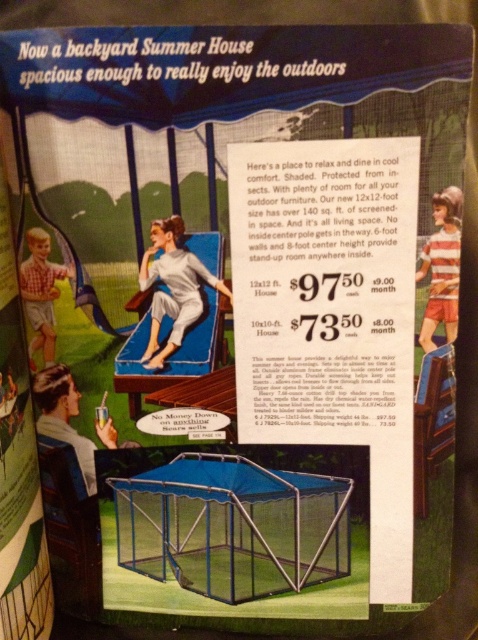
Is blue mesh cage at center below matte white lounge chair at center?

Yes, blue mesh cage at center is below matte white lounge chair at center.

Does point (173, 548) come in front of point (152, 272)?

No, it is behind (152, 272).

Describe the element at coordinates (232, 525) in the screenshot. This screenshot has height=640, width=478. I see `blue mesh cage at center` at that location.

Locate an element on the screen. The image size is (478, 640). blue mesh cage at center is located at coordinates (232, 525).

Is matte white lounge chair at center bigger than striped fabric shirt at upper right?

Yes.

Between matte white lounge chair at center and striped fabric shirt at upper right, which one appears on the right side from the viewer's perspective?

striped fabric shirt at upper right

Identify the location of matte white lounge chair at center. (173, 288).

Who is positioned more to the left, blue mesh cage at center or striped fabric shirt at upper right?

From the viewer's perspective, blue mesh cage at center appears more on the left side.

Who is lower down, blue mesh cage at center or striped fabric shirt at upper right?

Positioned lower is blue mesh cage at center.

The width and height of the screenshot is (478, 640). Find the location of `blue mesh cage at center`. blue mesh cage at center is located at coordinates (232, 525).